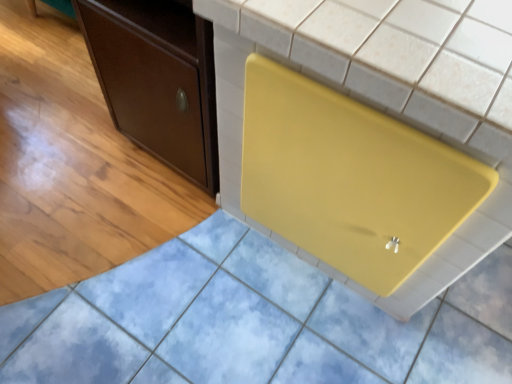
Question: Can you confirm if yellow matte cutting board at center is positioned to the left of matte brown cabinet at left?

Choices:
 (A) no
 (B) yes

Answer: (A)

Question: Can you confirm if yellow matte cutting board at center is smaller than matte brown cabinet at left?

Choices:
 (A) no
 (B) yes

Answer: (A)

Question: Is yellow matte cutting board at center thinner than matte brown cabinet at left?

Choices:
 (A) yes
 (B) no

Answer: (B)

Question: Is yellow matte cutting board at center not within matte brown cabinet at left?

Choices:
 (A) no
 (B) yes

Answer: (B)

Question: From a real-world perspective, is yellow matte cutting board at center located beneath matte brown cabinet at left?

Choices:
 (A) yes
 (B) no

Answer: (B)

Question: Considering the relative positions of yellow matte cutting board at center and matte brown cabinet at left in the image provided, is yellow matte cutting board at center to the right of matte brown cabinet at left from the viewer's perspective?

Choices:
 (A) yes
 (B) no

Answer: (A)

Question: Can we say matte brown cabinet at left lies outside yellow matte cutting board at center?

Choices:
 (A) no
 (B) yes

Answer: (B)

Question: From a real-world perspective, is matte brown cabinet at left on yellow matte cutting board at center?

Choices:
 (A) no
 (B) yes

Answer: (A)

Question: Considering the relative sizes of matte brown cabinet at left and yellow matte cutting board at center in the image provided, is matte brown cabinet at left thinner than yellow matte cutting board at center?

Choices:
 (A) yes
 (B) no

Answer: (A)

Question: Is matte brown cabinet at left wider than yellow matte cutting board at center?

Choices:
 (A) no
 (B) yes

Answer: (A)

Question: Is matte brown cabinet at left positioned with its back to yellow matte cutting board at center?

Choices:
 (A) no
 (B) yes

Answer: (A)

Question: Are matte brown cabinet at left and yellow matte cutting board at center beside each other?

Choices:
 (A) yes
 (B) no

Answer: (B)

Question: Is point (154, 38) closer or farther from the camera than point (331, 153)?

Choices:
 (A) farther
 (B) closer

Answer: (A)